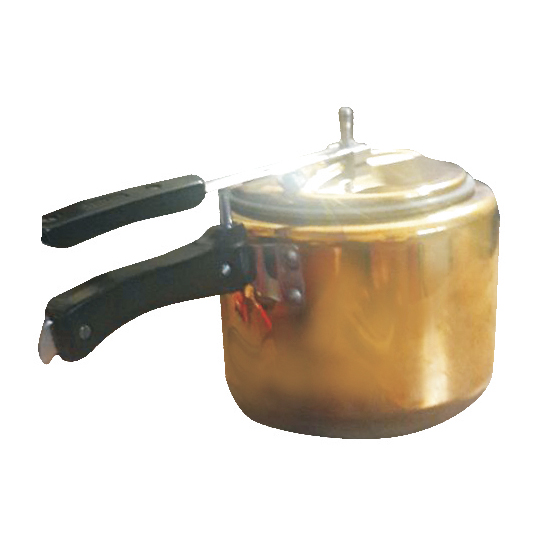
The image size is (540, 540). I want to click on left side  of pot, so click(224, 303).